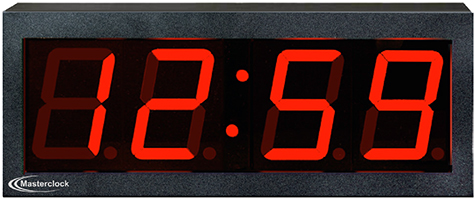
Image resolution: width=476 pixels, height=200 pixels. In order to click on clock top in this screenshot , I will do `click(444, 7)`, `click(98, 8)`.